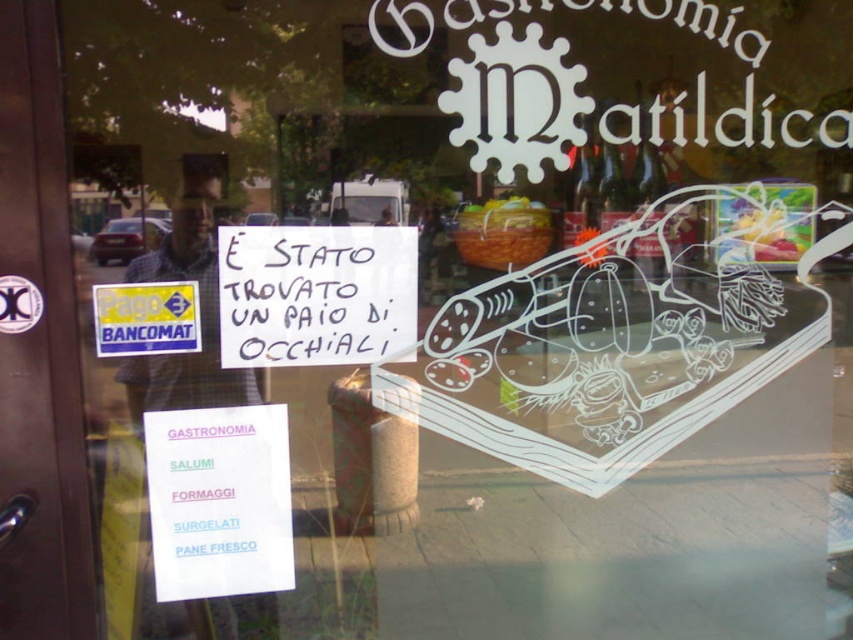
You are a delivery person trying to enter the shop. You see the brown wooden door at left and the white handwritten sign at center. Which one is bigger?

The brown wooden door at left is larger in size than the white handwritten sign at center, so the brown wooden door at left is bigger.

You are a customer standing outside the store looking through the window. You notice two signs inside the store. Which one is closer to you, the white handwritten sign at center or the white paper sign at lower left?

The white handwritten sign at center is closer to the viewer than the white paper sign at lower left.

You are a delivery person with a box that is 16 inches wide. You need to pass through the space between the brown wooden door at left and the white handwritten sign at center. Will your box fit through that space?

The distance between the brown wooden door at left and the white handwritten sign at center is 15.78 inches. Since the box is 16 inches wide, it is slightly wider than the available space, so the box will not fit through the space between them.